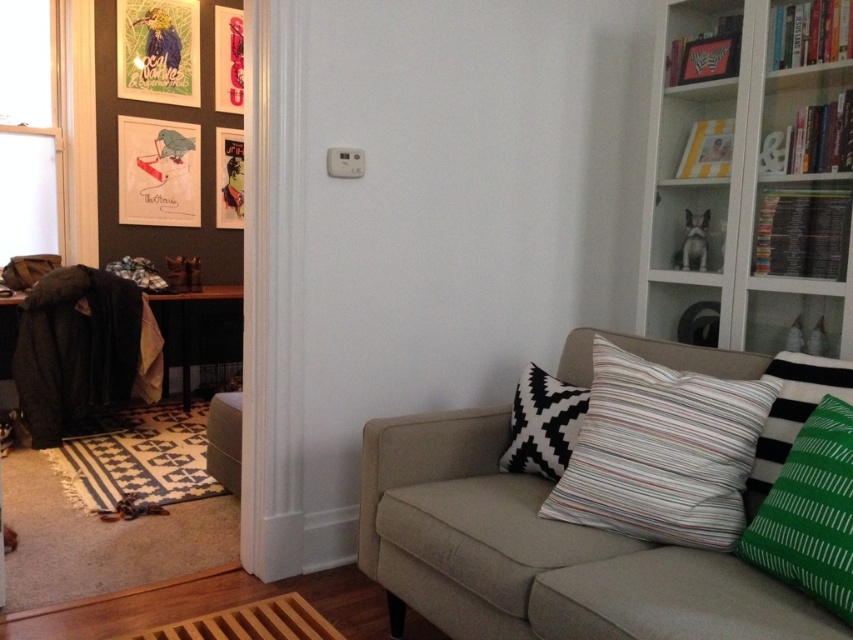
Between beige fabric couch at center and black and white zigzag pillow at upper right, which one has more height?

Standing taller between the two is beige fabric couch at center.

Between beige fabric couch at center and black and white zigzag pillow at upper right, which one is positioned higher?

black and white zigzag pillow at upper right is above.

Who is more forward, (x=640, y=593) or (x=514, y=408)?

Point (x=640, y=593) is more forward.

Locate an element on the screen. This screenshot has width=853, height=640. beige fabric couch at center is located at coordinates (538, 552).

Does point (737, 177) come in front of point (654, 476)?

No, it is behind (654, 476).

Which is behind, point (848, 358) or point (672, 413)?

Positioned behind is point (848, 358).

Find the location of a particular element. This screenshot has width=853, height=640. white glass bookshelf at upper right is located at coordinates 753,176.

Does striped fabric pillow at center have a smaller size compared to green striped pillow at right?

No.

Is striped fabric pillow at center below green striped pillow at right?

Actually, striped fabric pillow at center is above green striped pillow at right.

Image resolution: width=853 pixels, height=640 pixels. Find the location of `striped fabric pillow at center`. striped fabric pillow at center is located at coordinates (660, 452).

Where is `striped fabric pillow at center`? This screenshot has width=853, height=640. striped fabric pillow at center is located at coordinates (660, 452).